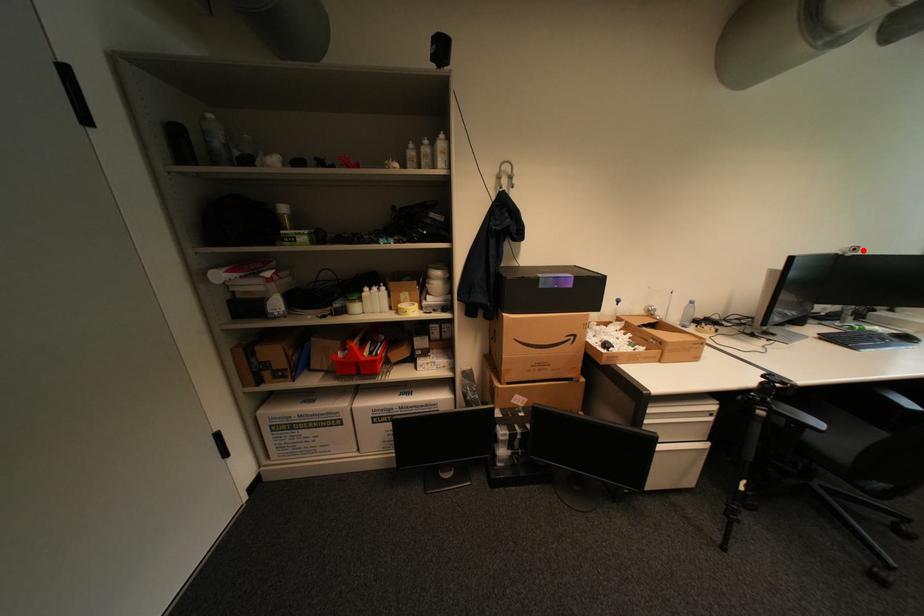
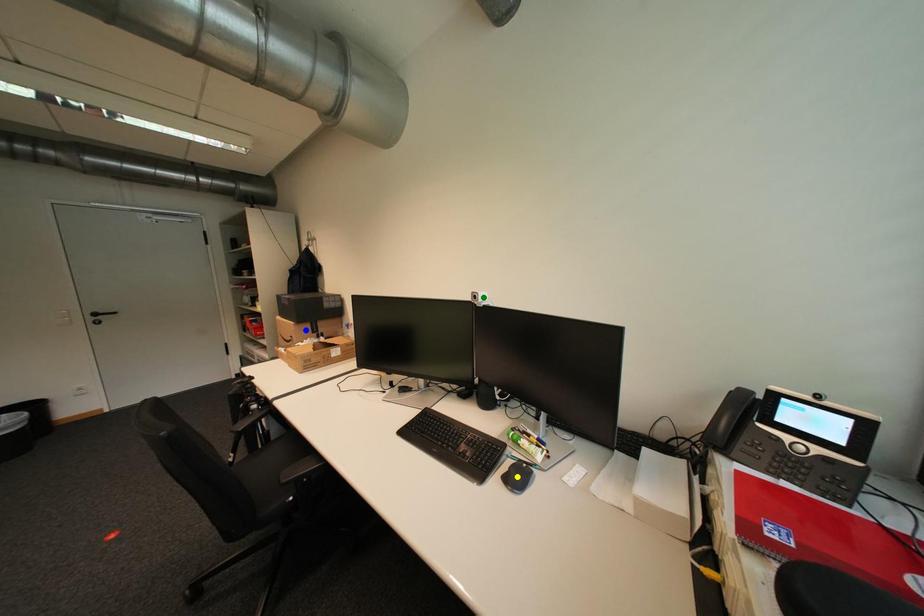
Question: I am providing you with two images of the same scene from different viewpoints. A red point is marked on the first image. You are given multiple points on the second image. Which point in image 2 is actually the same real-world point as the red point in image 1?

Choices:
 (A) yellow point
 (B) green point
 (C) blue point

Answer: (B)